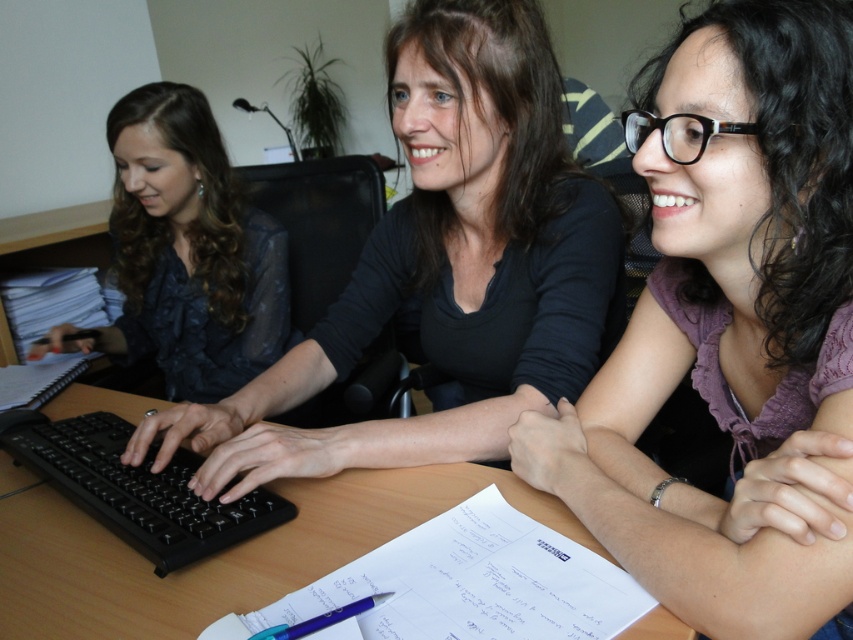
Does point (108, 557) come in front of point (173, 374)?

Yes, point (108, 557) is closer to viewer.

From the picture: Is wooden table at center closer to the viewer compared to matte black blouse at left?

Yes, it is.

Between point (96, 609) and point (202, 132), which one is positioned in front?

Point (96, 609) is in front.

Where is `wooden table at center`? The height and width of the screenshot is (640, 853). wooden table at center is located at coordinates (219, 552).

Is matte black shirt at center to the right of black plastic keyboard at center from the viewer's perspective?

Indeed, matte black shirt at center is positioned on the right side of black plastic keyboard at center.

Can you confirm if matte black shirt at center is smaller than black plastic keyboard at center?

Actually, matte black shirt at center might be larger than black plastic keyboard at center.

What are the coordinates of `matte black shirt at center` in the screenshot? It's located at [x=444, y=266].

Is matte black shirt at center to the left of blue plastic pen at lower center from the viewer's perspective?

Incorrect, matte black shirt at center is not on the left side of blue plastic pen at lower center.

Between matte black shirt at center and blue plastic pen at lower center, which one appears on the left side from the viewer's perspective?

blue plastic pen at lower center is more to the left.

Measure the distance between matte black shirt at center and camera.

A distance of 29.97 inches exists between matte black shirt at center and camera.

Identify the location of matte black shirt at center. (444, 266).